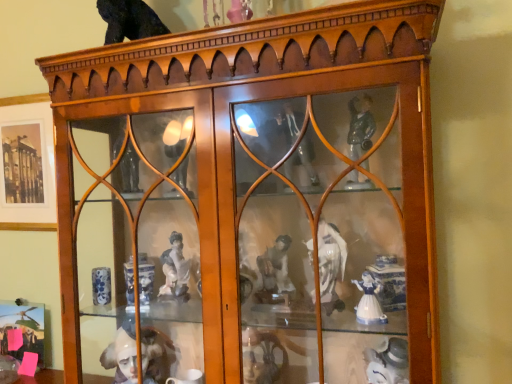
The image size is (512, 384). Identify the location of matte white picture frame at left. [x=27, y=164].

The height and width of the screenshot is (384, 512). Describe the element at coordinates (27, 164) in the screenshot. I see `matte white picture frame at left` at that location.

Identify the location of matte white picture frame at left. Image resolution: width=512 pixels, height=384 pixels. (27, 164).